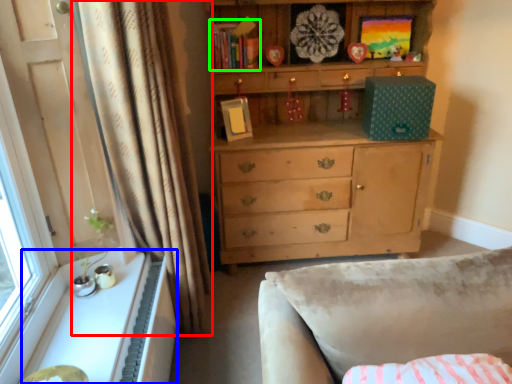
Question: Which object is positioned closest to curtain (highlighted by a red box)? Select from cabinetry (highlighted by a blue box) and book (highlighted by a green box).

Choices:
 (A) cabinetry
 (B) book

Answer: (A)